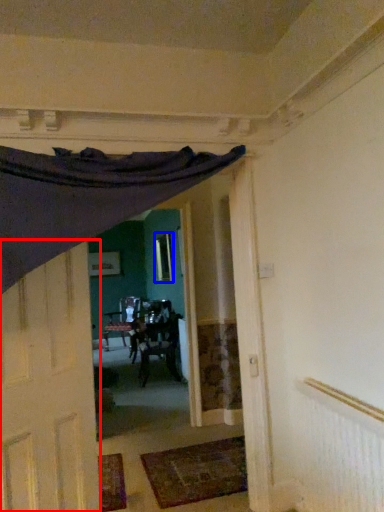
Question: Among these objects, which one is farthest to the camera, door (highlighted by a red box) or window (highlighted by a blue box)?

Choices:
 (A) door
 (B) window

Answer: (B)